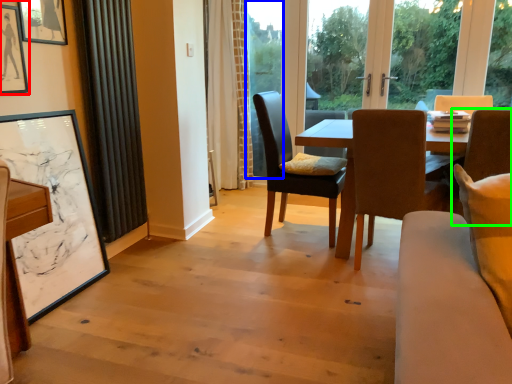
Question: Based on their relative distances, which object is nearer to picture frame (highlighted by a red box)? Choose from window screen (highlighted by a blue box) and chair (highlighted by a green box).

Choices:
 (A) window screen
 (B) chair

Answer: (B)